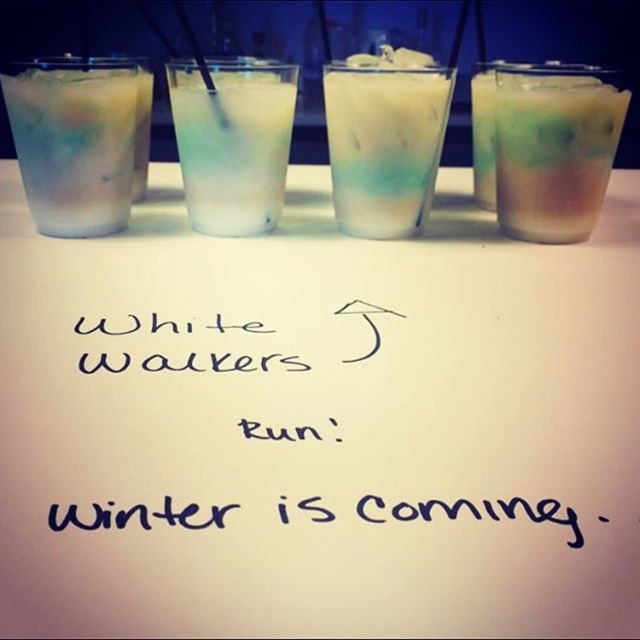
Can you confirm if white paper at center is shorter than translucent glass at center?

No.

Which is behind, point (102, 484) or point (337, 116)?

The point (337, 116) is more distant.

Locate an element on the screen. white paper at center is located at coordinates (317, 424).

Does point (70, 81) come closer to viewer compared to point (156, 369)?

No, it is not.

Between translucent glass at left and black handwritten note at center, which one is positioned lower?

Positioned lower is black handwritten note at center.

Is point (58, 216) positioned in front of point (74, 506)?

No.

Find the location of `translucent glass at left`. translucent glass at left is located at coordinates (74, 140).

Between point (582, 136) and point (186, 202), which one is positioned in front?

Point (582, 136) is in front.

Describe the element at coordinates (554, 147) in the screenshot. The height and width of the screenshot is (640, 640). I see `translucent glass at right` at that location.

I want to click on translucent glass at right, so click(554, 147).